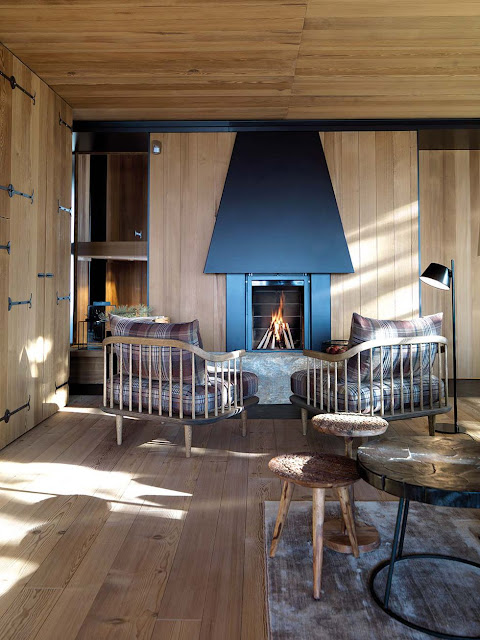
Find the location of `chair`. chair is located at coordinates (357, 384), (174, 370), (321, 468), (347, 422).